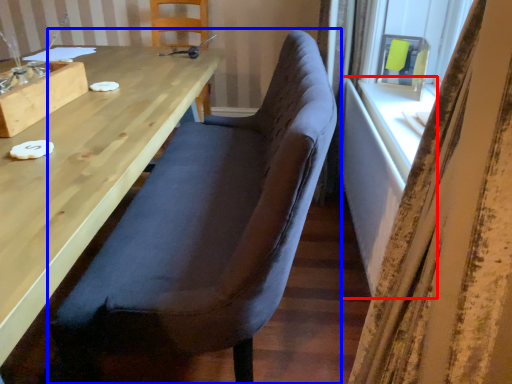
Question: Which object appears closest to the camera in this image, table (highlighted by a red box) or chair (highlighted by a blue box)?

Choices:
 (A) table
 (B) chair

Answer: (B)